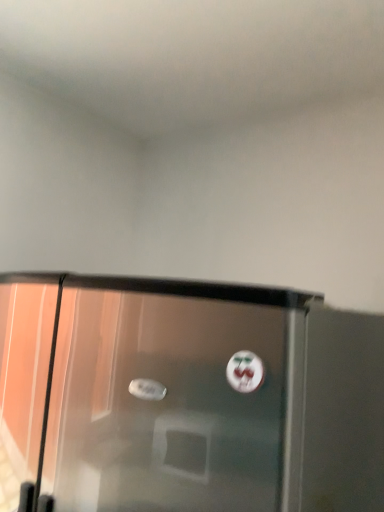
Where is `metallic refrigerator at center`? metallic refrigerator at center is located at coordinates (186, 397).

Describe the element at coordinates (186, 397) in the screenshot. I see `metallic refrigerator at center` at that location.

Locate an element on the screen. The image size is (384, 512). metallic refrigerator at center is located at coordinates pyautogui.click(x=186, y=397).